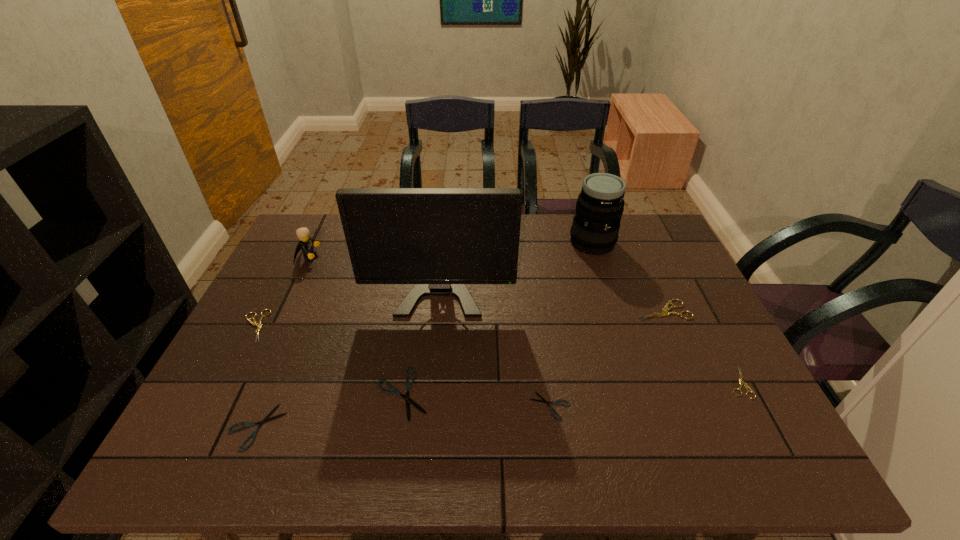
Where is `object situated at the near left corner`? The image size is (960, 540). object situated at the near left corner is located at coordinates (266, 419).

This screenshot has width=960, height=540. In the image, there is a desktop. Identify the location of free region at the near edge. (507, 457).

Identify the location of vacant space at the right edge of the desktop. (696, 366).

Identify the location of vacant space at the far right corner of the desktop. (628, 240).

At what (x,y) coordinates should I click in order to perform the action: click on vacant area at the near right corner. Please return your answer as a coordinate pair (x, y). This screenshot has height=540, width=960. Looking at the image, I should click on (740, 447).

This screenshot has width=960, height=540. What are the coordinates of `vacant space that is in between the rightmost shears and the second shears from right to left` in the screenshot? It's located at (700, 346).

Identify the location of free space between the tallest shears and the second tallest object. This screenshot has width=960, height=540. (627, 276).

At what (x,y) coordinates should I click in order to perform the action: click on vacant point located between the shortest shears and the computer monitor. Please return your answer as a coordinate pair (x, y). The image size is (960, 540). Looking at the image, I should click on (496, 333).

Locate an element on the screen. This screenshot has height=540, width=960. vacant region between the rightmost object and the third shears from right to left is located at coordinates (644, 394).

What are the coordinates of `free area in between the tallest object and the second black shears from left to right` in the screenshot? It's located at (422, 327).